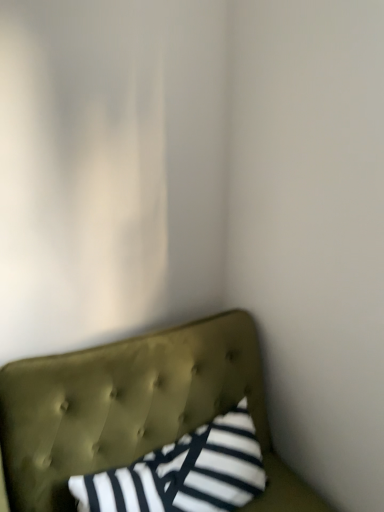
Locate an element on the screen. striped fabric pillow at center is located at coordinates (184, 472).

What is the approximate width of striped fabric pillow at center?

It is 22.46 centimeters.

Image resolution: width=384 pixels, height=512 pixels. Describe the element at coordinates (184, 472) in the screenshot. I see `striped fabric pillow at center` at that location.

The width and height of the screenshot is (384, 512). What do you see at coordinates (133, 409) in the screenshot?
I see `tufted olive green headboard at lower left` at bounding box center [133, 409].

Image resolution: width=384 pixels, height=512 pixels. Identify the location of tufted olive green headboard at lower left. (133, 409).

You are a GUI agent. You are given a task and a screenshot of the screen. Output one action in this format:
    pyautogui.click(x=<x>, y=<y>)
    Task: Click on the striped fabric pillow at center
    The width and height of the screenshot is (384, 512).
    Given the screenshot: What is the action you would take?
    pyautogui.click(x=184, y=472)

Is striped fabric pillow at center to the right of tufted olive green headboard at lower left from the viewer's perspective?

Incorrect, striped fabric pillow at center is not on the right side of tufted olive green headboard at lower left.

Between striped fabric pillow at center and tufted olive green headboard at lower left, which one is positioned in front?

tufted olive green headboard at lower left is closer to the camera.

Considering the positions of point (106, 507) and point (41, 437), is point (106, 507) closer or farther from the camera than point (41, 437)?

Point (106, 507) is closer to the camera than point (41, 437).

From the image's perspective, which one is positioned higher, striped fabric pillow at center or tufted olive green headboard at lower left?

From the image's view, striped fabric pillow at center is above.

From a real-world perspective, is striped fabric pillow at center above or below tufted olive green headboard at lower left?

In terms of real-world spatial position, striped fabric pillow at center is above tufted olive green headboard at lower left.

Consider the image. Between striped fabric pillow at center and tufted olive green headboard at lower left, which one has larger width?

tufted olive green headboard at lower left is wider.

From their relative heights in the image, would you say striped fabric pillow at center is taller or shorter than tufted olive green headboard at lower left?

striped fabric pillow at center is shorter than tufted olive green headboard at lower left.

Considering the relative sizes of striped fabric pillow at center and tufted olive green headboard at lower left in the image provided, is striped fabric pillow at center smaller than tufted olive green headboard at lower left?

Correct, striped fabric pillow at center occupies less space than tufted olive green headboard at lower left.

Is striped fabric pillow at center situated inside tufted olive green headboard at lower left or outside?

striped fabric pillow at center is spatially positioned inside tufted olive green headboard at lower left.

Is striped fabric pillow at center not close to tufted olive green headboard at lower left?

No, striped fabric pillow at center is not far away from tufted olive green headboard at lower left.

Is striped fabric pillow at center turned away from tufted olive green headboard at lower left?

Yes, striped fabric pillow at center's orientation is away from tufted olive green headboard at lower left.

Locate an element on the screen. This screenshot has height=512, width=384. furniture on the right of striped fabric pillow at center is located at coordinates (133, 409).

Which is more to the left, tufted olive green headboard at lower left or striped fabric pillow at center?

striped fabric pillow at center is more to the left.

Considering the relative positions of tufted olive green headboard at lower left and striped fabric pillow at center in the image provided, is tufted olive green headboard at lower left in front of striped fabric pillow at center?

Yes, it is.

Is point (237, 364) positioned after point (188, 501)?

Yes, it is behind point (188, 501).

From the image's perspective, is tufted olive green headboard at lower left beneath striped fabric pillow at center?

Indeed, from the image's perspective, tufted olive green headboard at lower left is shown beneath striped fabric pillow at center.

From a real-world perspective, between tufted olive green headboard at lower left and striped fabric pillow at center, who is vertically lower?

From a 3D spatial view, tufted olive green headboard at lower left is below.

Between tufted olive green headboard at lower left and striped fabric pillow at center, which one has smaller width?

Thinner between the two is striped fabric pillow at center.

Does tufted olive green headboard at lower left have a greater height compared to striped fabric pillow at center?

Indeed, tufted olive green headboard at lower left has a greater height compared to striped fabric pillow at center.

Is tufted olive green headboard at lower left bigger than striped fabric pillow at center?

Yes, tufted olive green headboard at lower left is bigger than striped fabric pillow at center.

Is tufted olive green headboard at lower left inside or outside of striped fabric pillow at center?

tufted olive green headboard at lower left is located beyond the bounds of striped fabric pillow at center.

Are tufted olive green headboard at lower left and striped fabric pillow at center making contact?

No, tufted olive green headboard at lower left is not with striped fabric pillow at center.

Is tufted olive green headboard at lower left facing towards striped fabric pillow at center?

Yes.

In order to click on furniture to the right of striped fabric pillow at center in this screenshot , I will do `click(133, 409)`.

Image resolution: width=384 pixels, height=512 pixels. What are the coordinates of `furniture below the striped fabric pillow at center (from a real-world perspective)` in the screenshot? It's located at (133, 409).

This screenshot has width=384, height=512. Find the location of `furniture on the right of striped fabric pillow at center`. furniture on the right of striped fabric pillow at center is located at coordinates (133, 409).